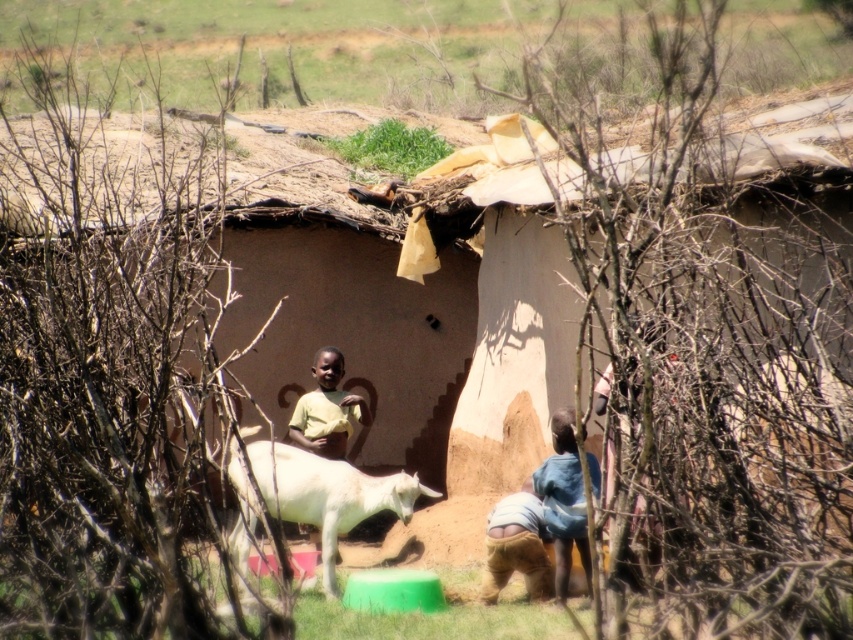
You are a photographer taking a picture of the blue denim skirt at lower right and the yellow matte shirt at center. Which one should you focus on first to ensure both are in sharp focus?

The blue denim skirt at lower right is closer to the viewer than the yellow matte shirt at center, so you should focus on the blue denim skirt at lower right first to ensure both are in sharp focus.

You are a photographer trying to capture a photo of the white matte goat at center and the yellow matte shirt at center. To ensure both subjects are in frame, you need to know their relative positions. Which object is located to the right of the other?

The white matte goat at center is positioned on the left side of yellow matte shirt at center, so the yellow matte shirt at center is to the right of the white matte goat at center.